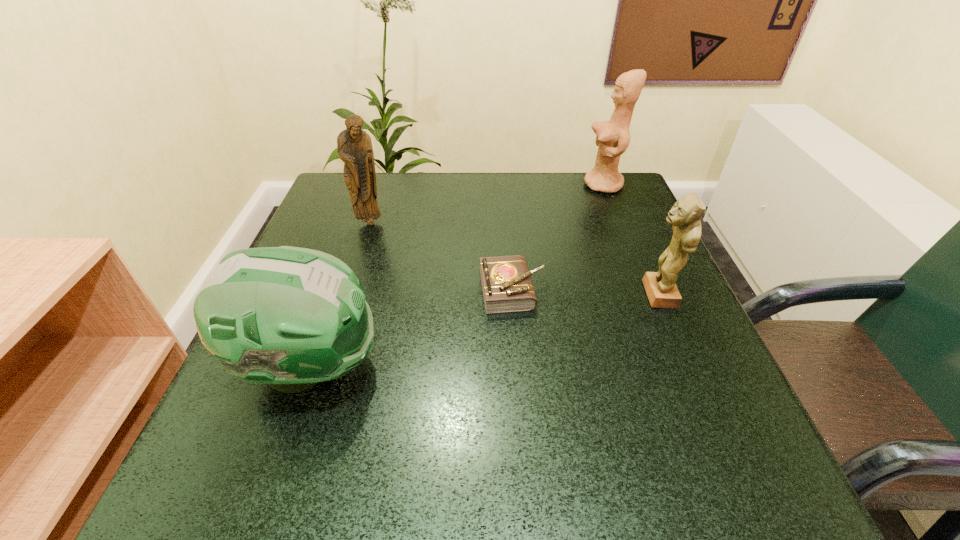
In the image, there is a desktop. Identify the location of vacant space at the far edge. This screenshot has height=540, width=960. (405, 224).

Find the location of a particular element. The width and height of the screenshot is (960, 540). free space at the near edge of the desktop is located at coordinates (504, 448).

Where is `free space at the left edge of the desktop`? Image resolution: width=960 pixels, height=540 pixels. free space at the left edge of the desktop is located at coordinates (230, 421).

The width and height of the screenshot is (960, 540). In the image, there is a desktop. Find the location of `vacant space at the right edge`. vacant space at the right edge is located at coordinates (593, 264).

Find the location of a particular element. This screenshot has height=540, width=960. vacant space at the far left corner is located at coordinates pyautogui.click(x=322, y=216).

This screenshot has width=960, height=540. Identify the location of free spot between the farthest object and the shortest figurine. (631, 240).

Identify the location of vacant area that lies between the nearest object and the nearest figurine. (484, 330).

Identify the location of vacant region between the nearest figurine and the football helmet. This screenshot has height=540, width=960. (484, 330).

Where is `free area in between the shortest object and the farthest object`? free area in between the shortest object and the farthest object is located at coordinates (558, 237).

Image resolution: width=960 pixels, height=540 pixels. What are the coordinates of `free space between the farthest figurine and the football helmet` in the screenshot? It's located at (457, 275).